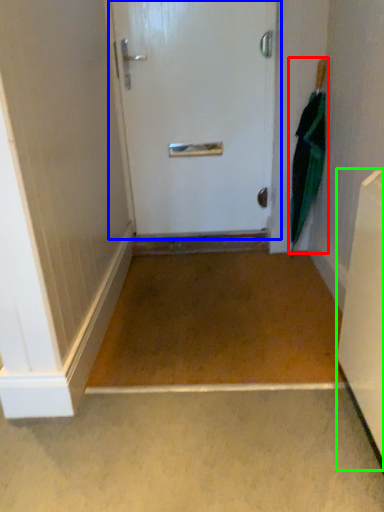
Question: Which is nearer to the umbrella (highlighted by a red box)? door (highlighted by a blue box) or appliance (highlighted by a green box).

Choices:
 (A) door
 (B) appliance

Answer: (A)